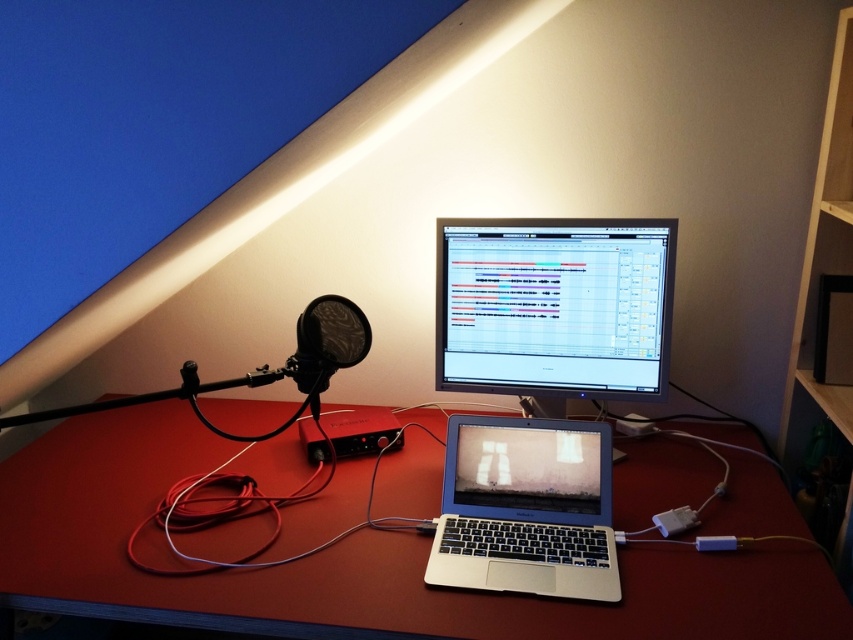
You are a technician who needs to adjust the settings on the matte black monitor at center. You are currently standing 1.2 meters away from it. Can you reach the monitor to make adjustments without moving closer?

The matte black monitor at center is 1.38 meters away from the viewer. Since you are currently 1.2 meters away, you are already closer than the monitor requires, so you can easily reach it to make adjustments.

You are setting up a new monitor in the workspace. The existing setup has a microphone and an audio interface on the left side of the desk. Where should you place the new matte black monitor at center to maintain symmetry with the microphone and audio interface?

The matte black monitor at center should be placed at point (554,307) to maintain symmetry with the microphone and audio interface.